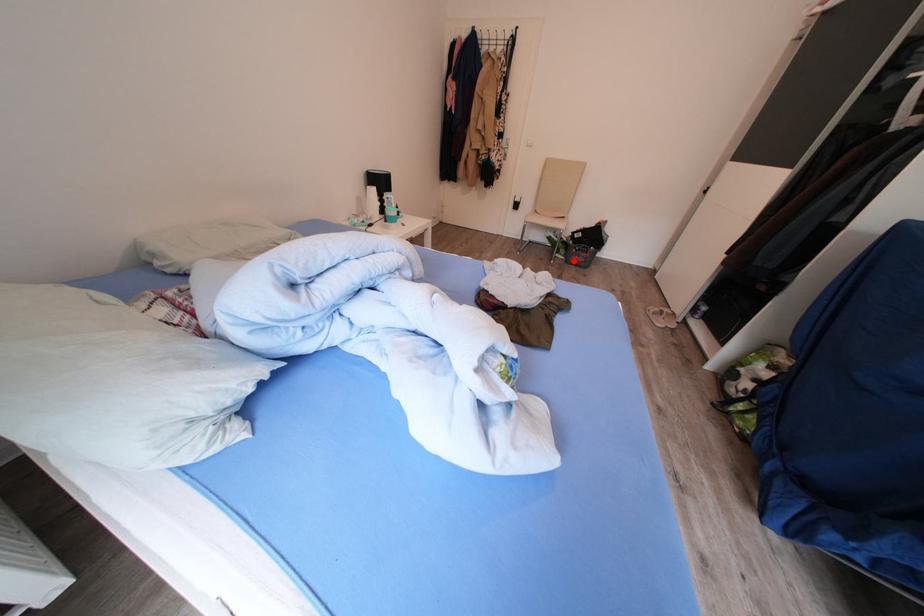
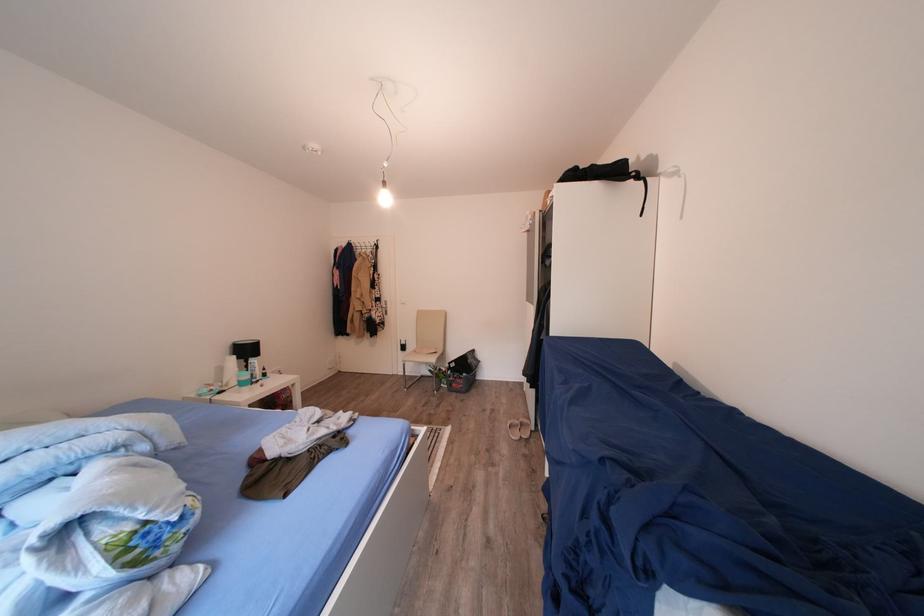
Find the pixel in the second image that matches the highlighted location in the first image.

(456, 390)